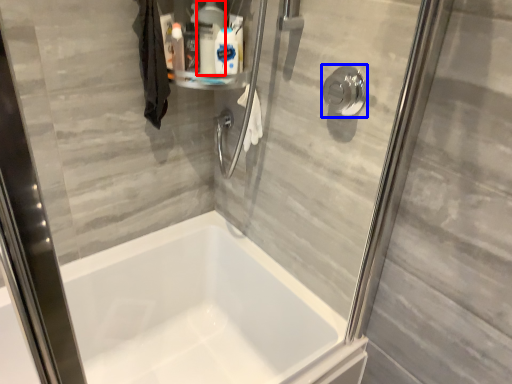
Question: Among these objects, which one is nearest to the camera, cleaning product (highlighted by a red box) or shower (highlighted by a blue box)?

Choices:
 (A) cleaning product
 (B) shower

Answer: (B)